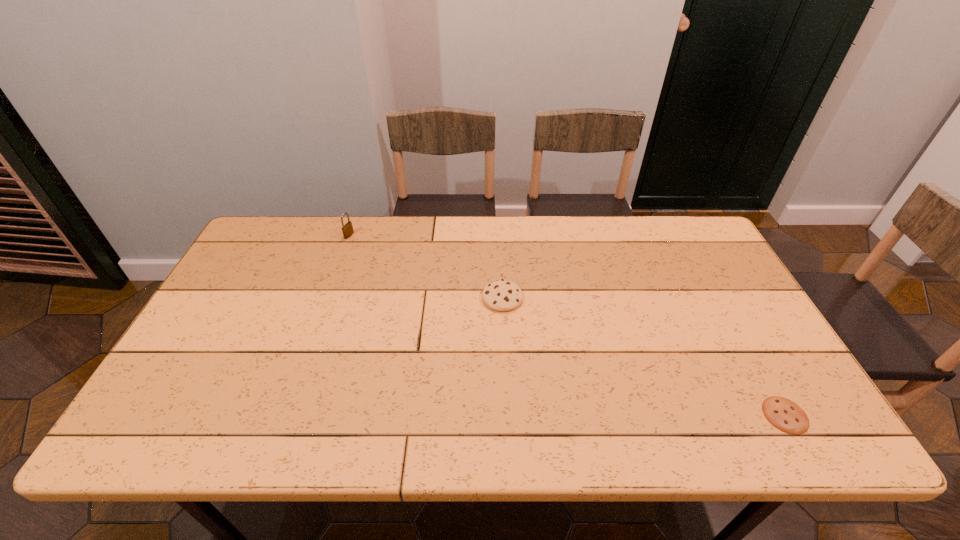
Locate an element on the screen. Image resolution: width=960 pixels, height=540 pixels. the leftmost object is located at coordinates (347, 229).

Where is `padlock`? This screenshot has width=960, height=540. padlock is located at coordinates (347, 229).

The width and height of the screenshot is (960, 540). Identify the location of the taller cookie. (502, 295).

The height and width of the screenshot is (540, 960). I want to click on the second farthest object, so click(x=502, y=295).

Where is `the shorter cookie`? the shorter cookie is located at coordinates (784, 414).

Find the location of a particular element. The width and height of the screenshot is (960, 540). the nearer cookie is located at coordinates (784, 414).

At what (x,y) coordinates should I click in order to perform the action: click on vacant region located 0.300m on the front of the leftmost object. Please return your answer as a coordinate pair (x, y). The height and width of the screenshot is (540, 960). Looking at the image, I should click on (324, 305).

The image size is (960, 540). Find the location of `vacant region located on the right of the taller cookie`. vacant region located on the right of the taller cookie is located at coordinates (661, 298).

Identify the location of free spot located on the left of the shorter cookie. This screenshot has height=540, width=960. (737, 415).

Where is `object that is at the far edge`? This screenshot has height=540, width=960. object that is at the far edge is located at coordinates (347, 229).